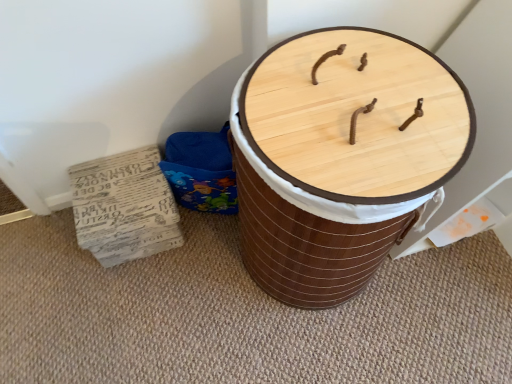
The width and height of the screenshot is (512, 384). Find the location of `free space to the left of wooden barrel at center`. free space to the left of wooden barrel at center is located at coordinates (187, 299).